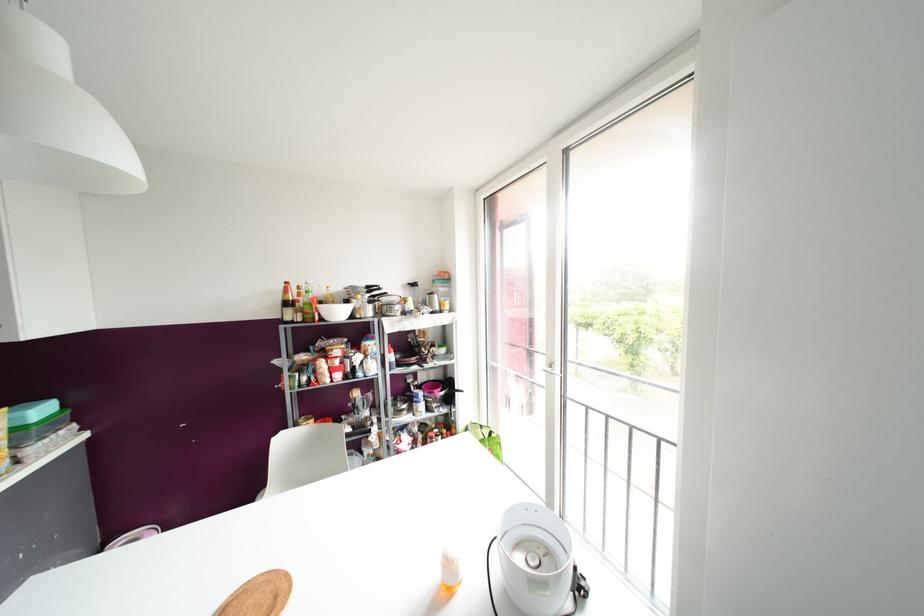
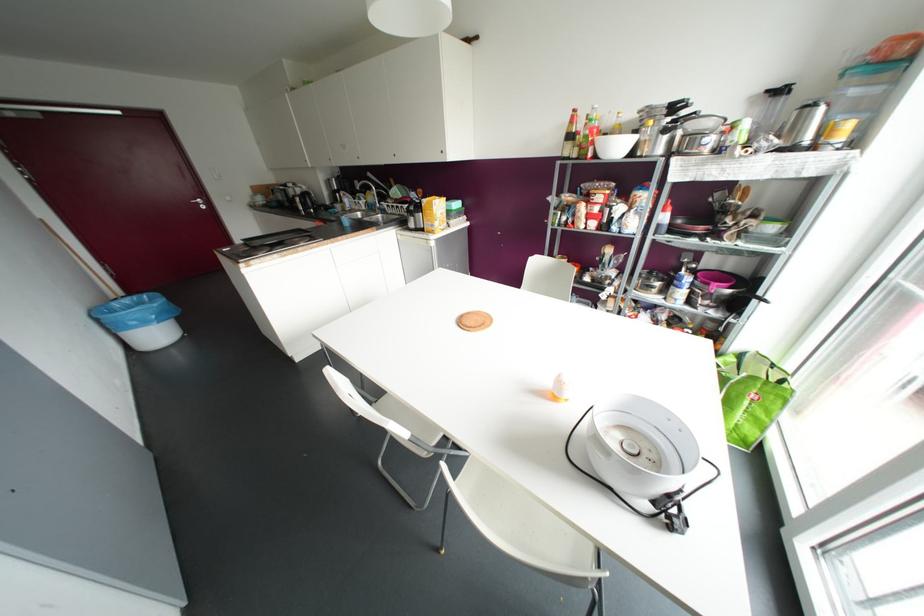
In the second image, find the point that corresponds to (480,426) in the first image.

(772, 365)